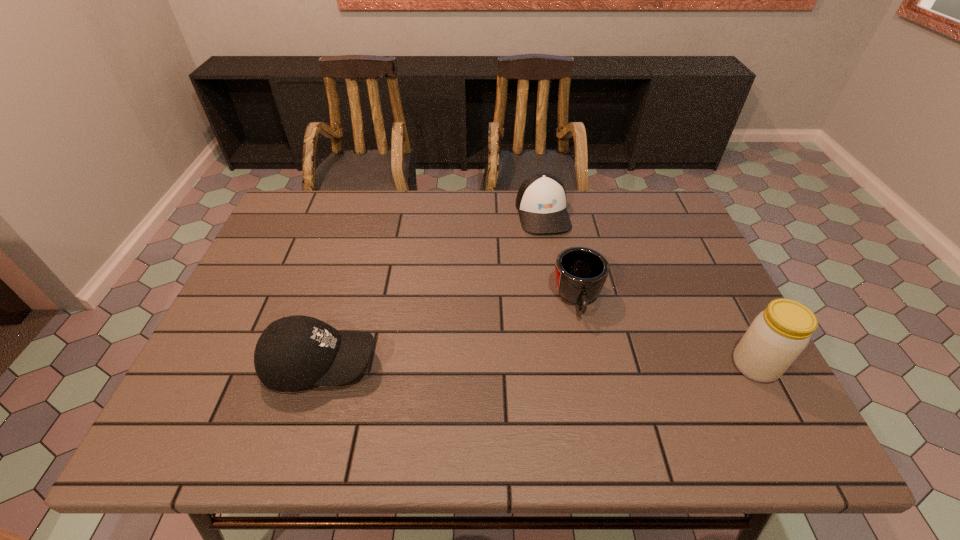
Find the location of `free space on the desktop that is between the baseball cap and the tallest object and is positioned on the front panel of the farthest object`. free space on the desktop that is between the baseball cap and the tallest object and is positioned on the front panel of the farthest object is located at coordinates (589, 365).

You are a GUI agent. You are given a task and a screenshot of the screen. Output one action in this format:
    pyautogui.click(x=<x>, y=<y>)
    Task: Click on the free space on the desktop that is between the leftmost object and the jar and is positioned on the side of the mug with the handle
    This screenshot has width=960, height=540.
    Given the screenshot: What is the action you would take?
    pyautogui.click(x=587, y=365)